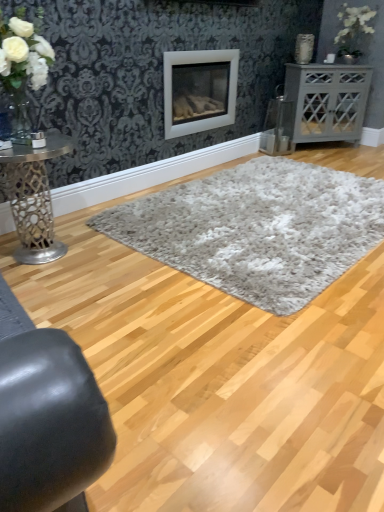
Question: Is metallic silver table at left, the second table positioned from the back, facing away from white fluffy rug at center, which is counted as the 1th plain, starting from the back?

Choices:
 (A) no
 (B) yes

Answer: (A)

Question: Is metallic silver table at left, which is counted as the 1th table, starting from the bottom, directly adjacent to white fluffy rug at center, which is counted as the 1th plain, starting from the back?

Choices:
 (A) yes
 (B) no

Answer: (B)

Question: Considering the relative sizes of metallic silver table at left, acting as the second table starting from the top, and white fluffy rug at center, which is counted as the 1th plain, starting from the back, in the image provided, is metallic silver table at left, acting as the second table starting from the top, wider than white fluffy rug at center, which is counted as the 1th plain, starting from the back,?

Choices:
 (A) yes
 (B) no

Answer: (B)

Question: Is metallic silver table at left, which is counted as the 1th table, starting from the bottom, outside of white fluffy rug at center, which is counted as the 1th plain, starting from the back?

Choices:
 (A) yes
 (B) no

Answer: (A)

Question: Is white fluffy rug at center, which is counted as the 1th plain, starting from the back, surrounded by metallic silver table at left, acting as the first table starting from the left?

Choices:
 (A) no
 (B) yes

Answer: (A)

Question: In the image, is metallic silver table at left, which is counted as the 1th table, starting from the bottom, positioned in front of or behind white matte wood burning stove at center?

Choices:
 (A) front
 (B) behind

Answer: (A)

Question: From their relative heights in the image, would you say metallic silver table at left, acting as the first table starting from the left, is taller or shorter than white matte wood burning stove at center?

Choices:
 (A) tall
 (B) short

Answer: (B)

Question: From the image's perspective, relative to white matte wood burning stove at center, is metallic silver table at left, marked as the first table in a front-to-back arrangement, above or below?

Choices:
 (A) above
 (B) below

Answer: (B)

Question: From a real-world perspective, is metallic silver table at left, acting as the first table starting from the left, physically located above or below white matte wood burning stove at center?

Choices:
 (A) below
 (B) above

Answer: (A)

Question: Is white shag rug at center, the 1th plain in the front-to-back sequence, taller or shorter than white fluffy rug at center, the second plain from the front?

Choices:
 (A) short
 (B) tall

Answer: (A)

Question: From the image's perspective, is white shag rug at center, which is the second plain from back to front, positioned above or below white fluffy rug at center, the second plain from the front?

Choices:
 (A) above
 (B) below

Answer: (B)

Question: Is white shag rug at center, which is the second plain from back to front, to the left or to the right of white fluffy rug at center, which is counted as the 1th plain, starting from the back, in the image?

Choices:
 (A) right
 (B) left

Answer: (A)

Question: Relative to white fluffy rug at center, which is counted as the 1th plain, starting from the back, is white shag rug at center, the 1th plain in the front-to-back sequence, in front or behind?

Choices:
 (A) front
 (B) behind

Answer: (A)

Question: Is white fluffy rug at center, the second plain from the front, spatially inside gray matte cabinet at right, positioned as the 1th table in right-to-left order, or outside of it?

Choices:
 (A) inside
 (B) outside

Answer: (B)

Question: In terms of height, does white fluffy rug at center, the second plain from the front, look taller or shorter compared to gray matte cabinet at right, positioned as the 1th table in right-to-left order?

Choices:
 (A) short
 (B) tall

Answer: (A)